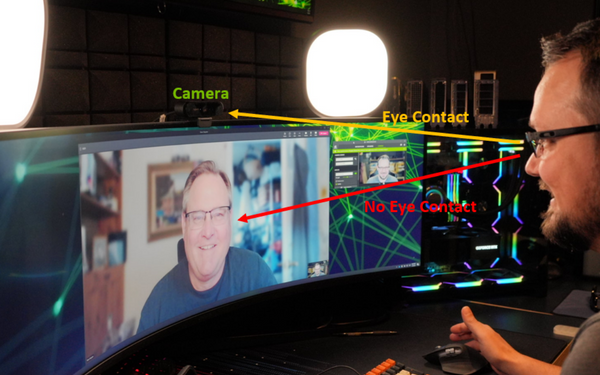
You are a GUI agent. You are given a task and a screenshot of the screen. Output one action in this format:
    pyautogui.click(x=<x>, y=<y>)
    Task: Click on the keyboard
    
    Given the screenshot: What is the action you would take?
    pyautogui.click(x=385, y=368)